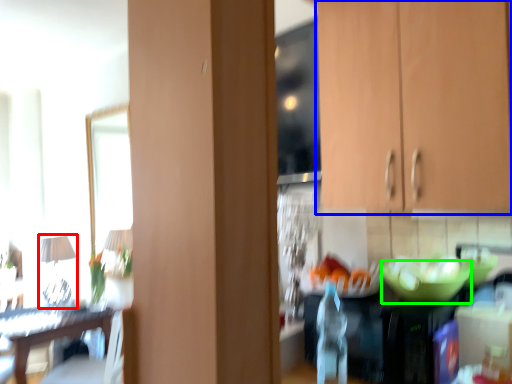
Question: Which object is the farthest from lamp (highlighted by a red box)? Choose among these: cabinetry (highlighted by a blue box) or glass bowl (highlighted by a green box).

Choices:
 (A) cabinetry
 (B) glass bowl

Answer: (A)